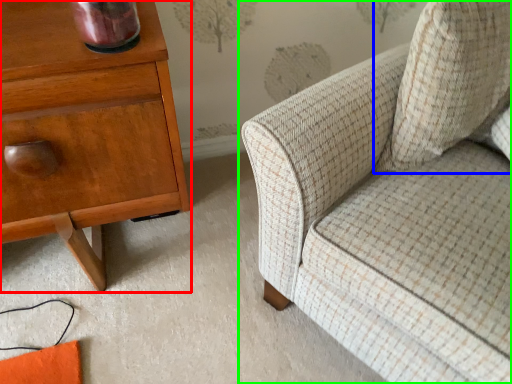
Question: Estimate the real-world distances between objects in this image. Which object is farther from nightstand (highlighted by a red box), throw pillow (highlighted by a blue box) or chair (highlighted by a green box)?

Choices:
 (A) throw pillow
 (B) chair

Answer: (A)